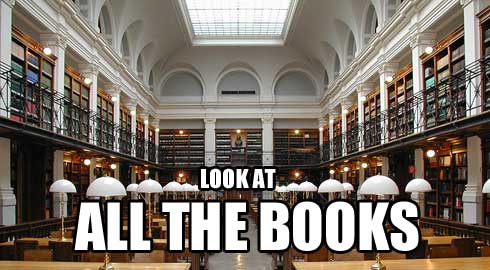
What are the coordinates of `white book bottom shelf` in the screenshot? It's located at (414, 114), (445, 213).